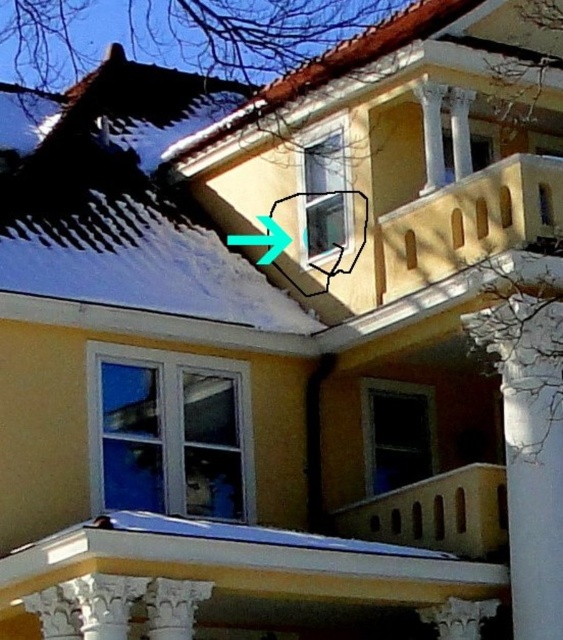
Question: Can you confirm if smooth shingles roof at upper center is positioned to the right of green plastic arrow at upper center?

Choices:
 (A) no
 (B) yes

Answer: (B)

Question: Is the position of smooth shingles roof at upper center less distant than that of green plastic arrow at upper center?

Choices:
 (A) no
 (B) yes

Answer: (B)

Question: Which of the following is the farthest from the observer?

Choices:
 (A) smooth shingles roof at upper center
 (B) smooth shingles at upper left

Answer: (A)

Question: Estimate the real-world distances between objects in this image. Which object is farther from the smooth shingles roof at upper center?

Choices:
 (A) green plastic arrow at upper center
 (B) smooth shingles at upper left

Answer: (B)

Question: Is smooth shingles at upper left in front of green plastic arrow at upper center?

Choices:
 (A) no
 (B) yes

Answer: (B)

Question: Based on their relative distances, which object is farther from the smooth shingles at upper left?

Choices:
 (A) green plastic arrow at upper center
 (B) smooth shingles roof at upper center

Answer: (B)